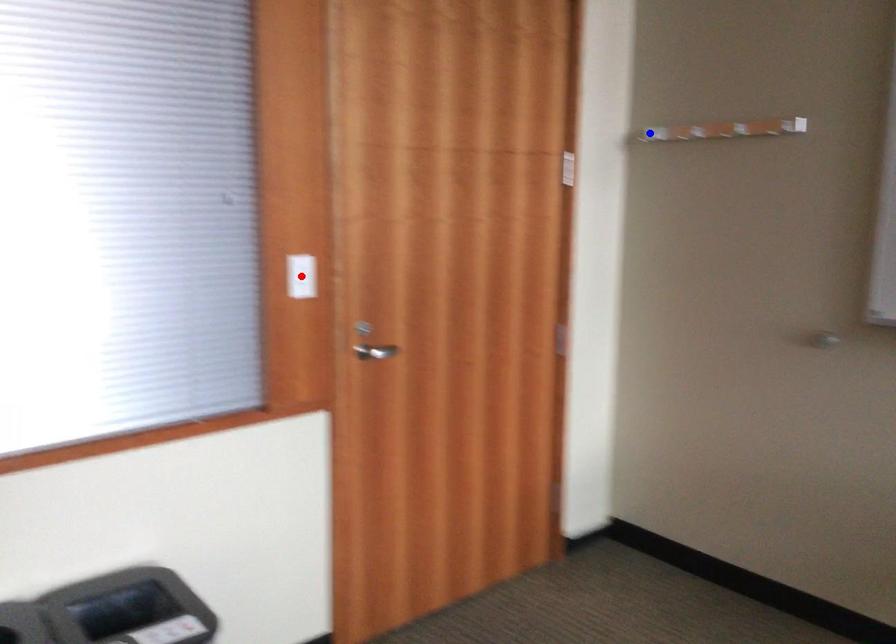
Question: Two points are marked on the image. Which point is closer to the camera?

Choices:
 (A) Blue point is closer.
 (B) Red point is closer.

Answer: (B)